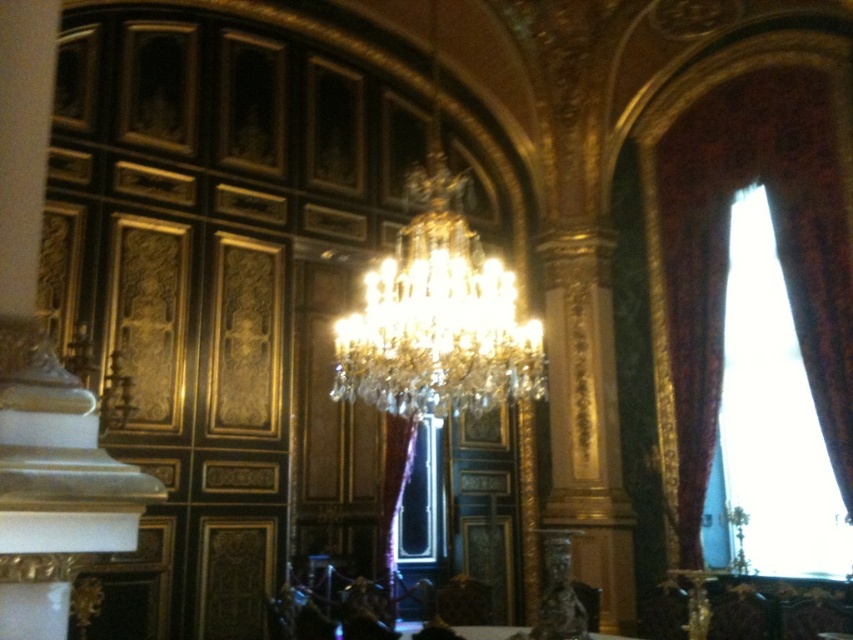
Between velvet drapery at right and satin gold curtain at center, which one appears on the right side from the viewer's perspective?

velvet drapery at right is more to the right.

The width and height of the screenshot is (853, 640). Describe the element at coordinates (776, 252) in the screenshot. I see `velvet drapery at right` at that location.

What do you see at coordinates (776, 252) in the screenshot? I see `velvet drapery at right` at bounding box center [776, 252].

The height and width of the screenshot is (640, 853). I want to click on velvet drapery at right, so click(x=776, y=252).

At what (x,y) coordinates should I click in order to perform the action: click on clear crystal chandelier at center. Please return your answer as a coordinate pair (x, y). Looking at the image, I should click on (437, 328).

Between point (335, 358) and point (416, 621), which one is positioned behind?

Positioned behind is point (416, 621).

The image size is (853, 640). Find the location of `clear crystal chandelier at center`. clear crystal chandelier at center is located at coordinates (437, 328).

Is the position of velvet drapery at right more distant than that of clear crystal chandelier at center?

Yes, velvet drapery at right is further from the viewer.

The height and width of the screenshot is (640, 853). Describe the element at coordinates (776, 252) in the screenshot. I see `velvet drapery at right` at that location.

In order to click on velvet drapery at right in this screenshot , I will do `click(776, 252)`.